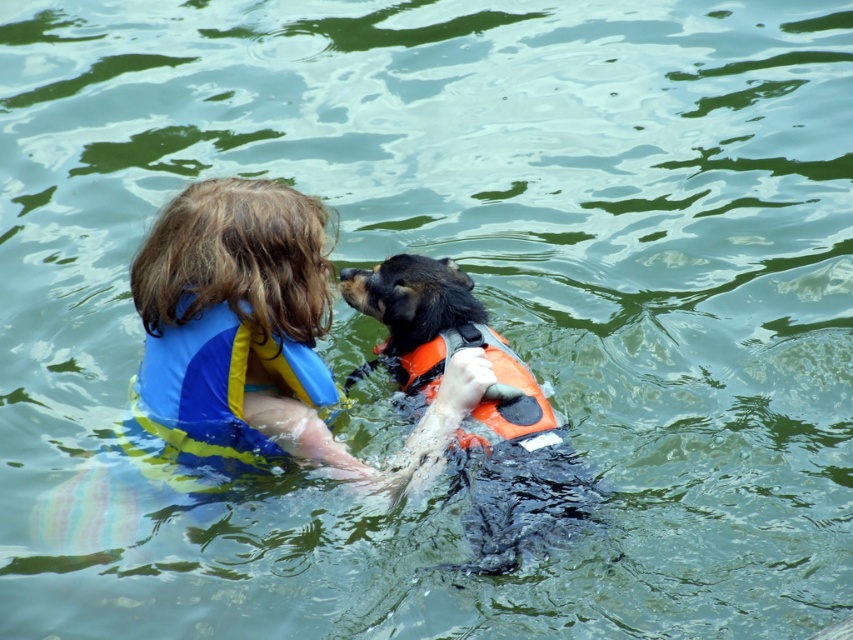
Does orange life vest at center come in front of blue/yellow fabric life jacket at upper left?

Yes, orange life vest at center is in front of blue/yellow fabric life jacket at upper left.

Image resolution: width=853 pixels, height=640 pixels. Identify the location of orange life vest at center. (474, 408).

In the scene shown: Can you confirm if blue/yellow fabric life jacket at upper left is positioned above orange fabric life jacket at center?

No, blue/yellow fabric life jacket at upper left is not above orange fabric life jacket at center.

Image resolution: width=853 pixels, height=640 pixels. I want to click on blue/yellow fabric life jacket at upper left, so click(x=212, y=397).

Is point (247, 440) positioned before point (508, 440)?

No, (247, 440) is behind (508, 440).

Image resolution: width=853 pixels, height=640 pixels. I want to click on blue/yellow fabric life jacket at upper left, so click(x=212, y=397).

Is orange life vest at center positioned behind orange fabric life jacket at center?

No, orange life vest at center is closer to the viewer.

Which is more to the right, orange life vest at center or orange fabric life jacket at center?

orange fabric life jacket at center is more to the right.

This screenshot has height=640, width=853. What do you see at coordinates (474, 408) in the screenshot?
I see `orange life vest at center` at bounding box center [474, 408].

The image size is (853, 640). I want to click on orange life vest at center, so click(474, 408).